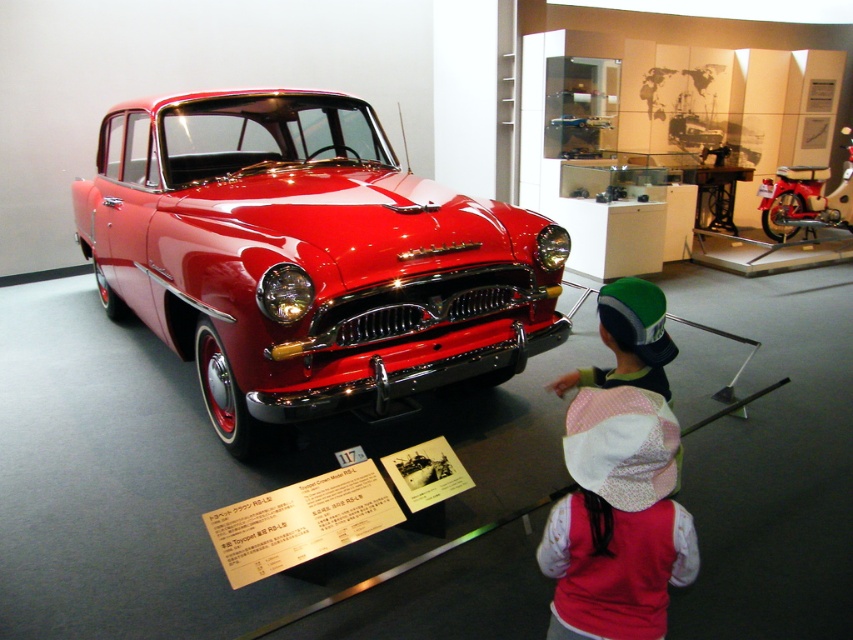
Does shiny red car at center have a larger size compared to pink fabric hat at lower center?

Yes, shiny red car at center is bigger than pink fabric hat at lower center.

Is shiny red car at center to the left of pink fabric hat at lower center from the viewer's perspective?

Indeed, shiny red car at center is positioned on the left side of pink fabric hat at lower center.

Is point (529, 224) in front of point (596, 422)?

No, it is behind (596, 422).

The width and height of the screenshot is (853, 640). Identify the location of shiny red car at center. (306, 259).